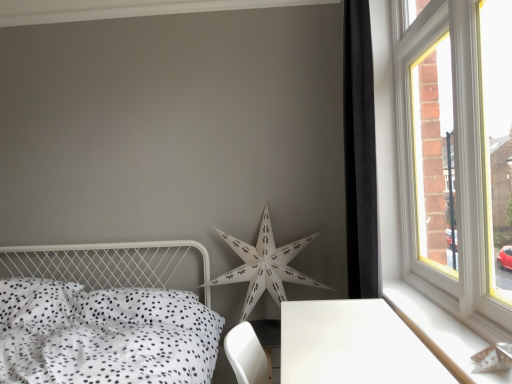
Question: Considering the positions of white wood at right and white glossy table at lower right in the image, is white wood at right taller or shorter than white glossy table at lower right?

Choices:
 (A) short
 (B) tall

Answer: (A)

Question: From the image's perspective, is white wood at right located above or below white glossy table at lower right?

Choices:
 (A) below
 (B) above

Answer: (B)

Question: Considering the real-world distances, which object is farthest from the white paper star at center?

Choices:
 (A) white wood at right
 (B) black velvet curtain at right
 (C) white plastic window at right
 (D) white glossy table at lower right
 (E) white dotted fabric bed at lower left

Answer: (D)

Question: Estimate the real-world distances between objects in this image. Which object is closer to the white paper star at center?

Choices:
 (A) white wood at right
 (B) white glossy table at lower right
 (C) black velvet curtain at right
 (D) white dotted fabric bed at lower left
 (E) white plastic window at right

Answer: (D)